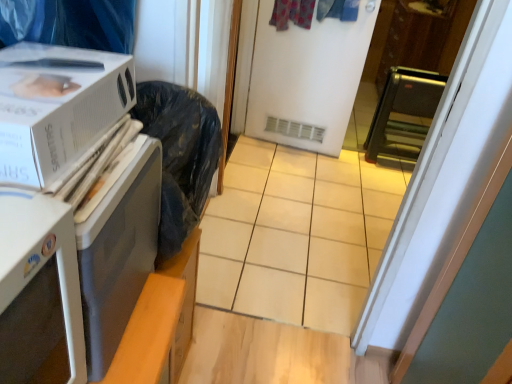
At what (x,y) coordinates should I click in order to perform the action: click on blank space situated above white cardboard box at left (from a real-world perspective). Please return your answer as a coordinate pair (x, y). Looking at the image, I should click on (42, 83).